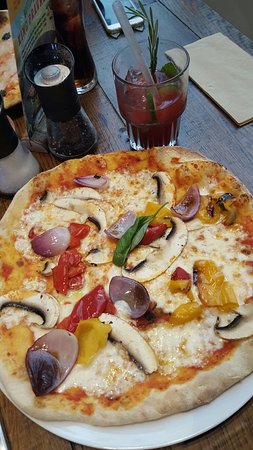
Identify the location of table. This screenshot has height=450, width=253. (224, 437).